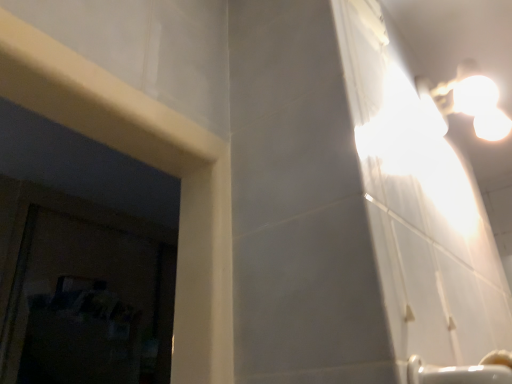
Question: Is white ceramic faucet at lower right a part of white glossy light fixture at upper right?

Choices:
 (A) yes
 (B) no

Answer: (B)

Question: Is white glossy light fixture at upper right not within white ceramic faucet at lower right?

Choices:
 (A) yes
 (B) no

Answer: (A)

Question: Does white glossy light fixture at upper right have a lesser height compared to white ceramic faucet at lower right?

Choices:
 (A) yes
 (B) no

Answer: (B)

Question: Is white glossy light fixture at upper right oriented towards white ceramic faucet at lower right?

Choices:
 (A) no
 (B) yes

Answer: (A)

Question: From the image's perspective, is white glossy light fixture at upper right located above white ceramic faucet at lower right?

Choices:
 (A) yes
 (B) no

Answer: (A)

Question: From a real-world perspective, is white glossy light fixture at upper right under white ceramic faucet at lower right?

Choices:
 (A) no
 (B) yes

Answer: (A)

Question: Can you confirm if white ceramic faucet at lower right is taller than white glossy light fixture at upper right?

Choices:
 (A) yes
 (B) no

Answer: (B)

Question: Can you confirm if white ceramic faucet at lower right is thinner than white glossy light fixture at upper right?

Choices:
 (A) no
 (B) yes

Answer: (B)

Question: Can you confirm if white ceramic faucet at lower right is shorter than white glossy light fixture at upper right?

Choices:
 (A) yes
 (B) no

Answer: (A)

Question: Is white ceramic faucet at lower right at the left side of white glossy light fixture at upper right?

Choices:
 (A) yes
 (B) no

Answer: (A)

Question: From a real-world perspective, is white ceramic faucet at lower right over white glossy light fixture at upper right?

Choices:
 (A) no
 (B) yes

Answer: (A)

Question: From a real-world perspective, is white ceramic faucet at lower right physically below white glossy light fixture at upper right?

Choices:
 (A) no
 (B) yes

Answer: (B)

Question: Is white ceramic faucet at lower right to the left or to the right of white glossy light fixture at upper right in the image?

Choices:
 (A) right
 (B) left

Answer: (B)